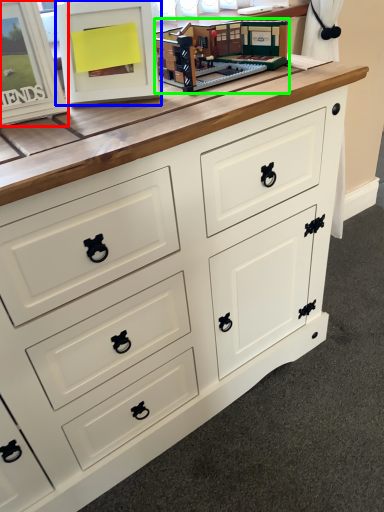
Question: Considering the real-world distances, which object is farthest from picture frame (highlighted by a red box)? picture frame (highlighted by a blue box) or toy (highlighted by a green box)?

Choices:
 (A) picture frame
 (B) toy

Answer: (B)